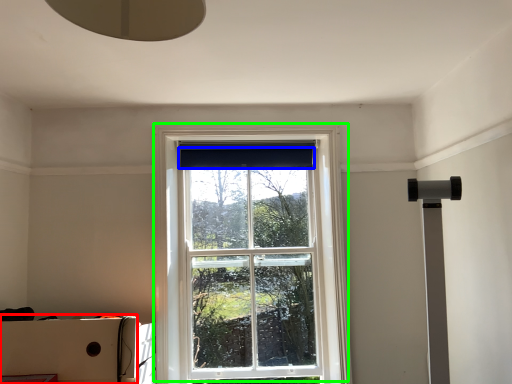
Question: Based on their relative distances, which object is farther from cardboard box (highlighted by a red box)? Choose from curtain (highlighted by a blue box) and window (highlighted by a green box).

Choices:
 (A) curtain
 (B) window

Answer: (A)